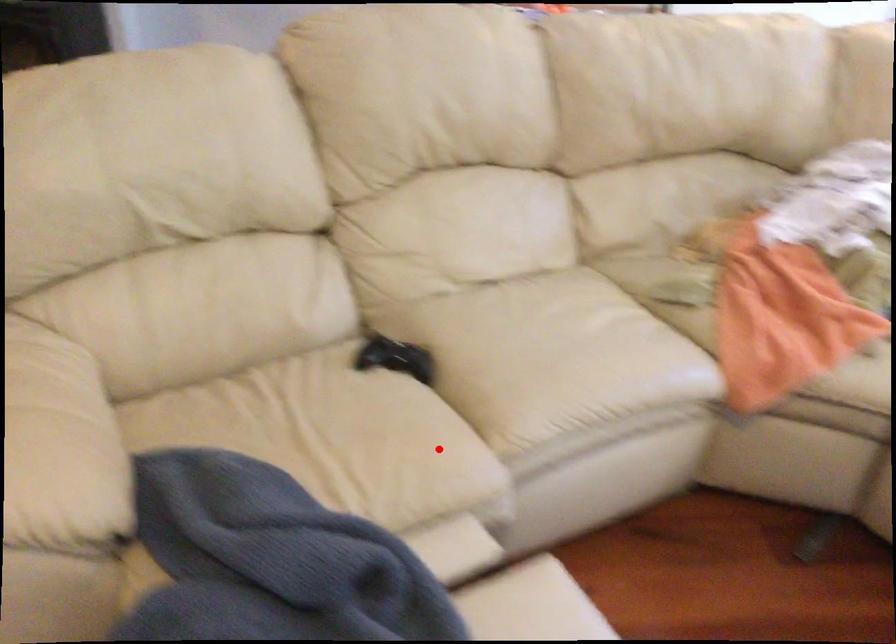
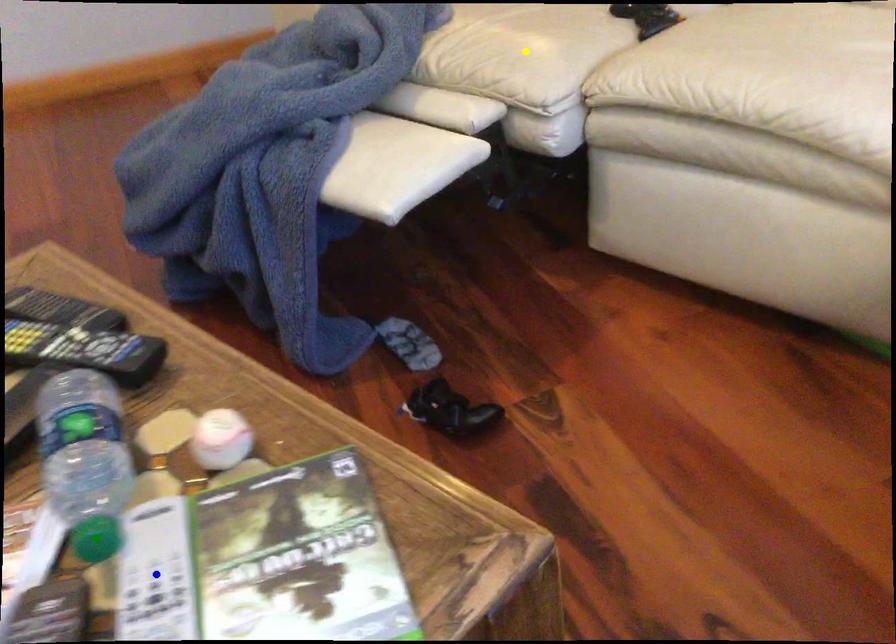
Question: I am providing you with two images of the same scene from different viewpoints. A red point is marked on the first image. You are given multiple points on the second image. Which mark in image 2 goes with the point in image 1?

Choices:
 (A) green point
 (B) yellow point
 (C) blue point

Answer: (B)